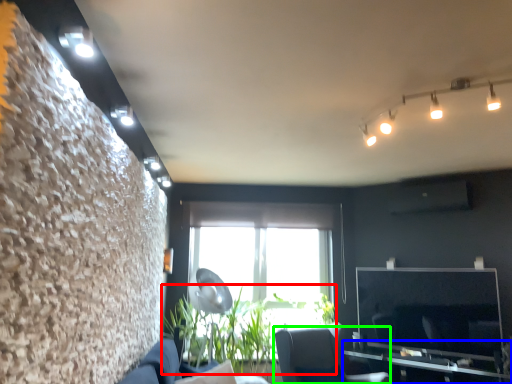
Question: Estimate the real-world distances between objects in this image. Which object is closer to plant (highlighted by a red box), table (highlighted by a blue box) or furniture (highlighted by a green box)?

Choices:
 (A) table
 (B) furniture

Answer: (B)